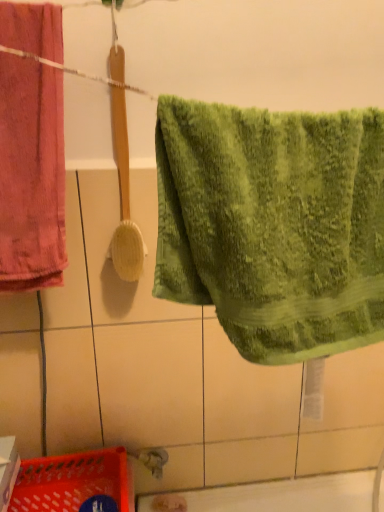
Question: From the image's perspective, would you say wooden textured brush at center is shown under green textured towel at center, placed as the 1th towel when sorted from right to left?

Choices:
 (A) no
 (B) yes

Answer: (A)

Question: From the image's perspective, is wooden textured brush at center on top of green textured towel at center, which ranks as the second towel in left-to-right order?

Choices:
 (A) yes
 (B) no

Answer: (A)

Question: From a real-world perspective, is wooden textured brush at center positioned over green textured towel at center, placed as the 1th towel when sorted from right to left, based on gravity?

Choices:
 (A) no
 (B) yes

Answer: (B)

Question: Is the position of wooden textured brush at center less distant than that of green textured towel at center, which is counted as the 2th towel, starting from the back?

Choices:
 (A) no
 (B) yes

Answer: (A)

Question: Is the position of wooden textured brush at center more distant than that of green textured towel at center, which appears as the first towel when viewed from the front?

Choices:
 (A) yes
 (B) no

Answer: (A)

Question: Are wooden textured brush at center and green textured towel at center, which is counted as the 2th towel, starting from the back, making contact?

Choices:
 (A) no
 (B) yes

Answer: (A)

Question: Is wooden textured brush at center inside velvety pink towel at left, which ranks as the 1th towel in back-to-front order?

Choices:
 (A) no
 (B) yes

Answer: (A)

Question: Does velvety pink towel at left, which ranks as the second towel in front-to-back order, touch wooden textured brush at center?

Choices:
 (A) no
 (B) yes

Answer: (A)

Question: From the image's perspective, is velvety pink towel at left, acting as the 1th towel starting from the left, located above wooden textured brush at center?

Choices:
 (A) no
 (B) yes

Answer: (A)

Question: Is velvety pink towel at left, acting as the 1th towel starting from the left, positioned with its back to wooden textured brush at center?

Choices:
 (A) yes
 (B) no

Answer: (B)

Question: Can you confirm if velvety pink towel at left, which ranks as the 1th towel in back-to-front order, is bigger than wooden textured brush at center?

Choices:
 (A) no
 (B) yes

Answer: (B)

Question: Is velvety pink towel at left, acting as the 1th towel starting from the left, outside wooden textured brush at center?

Choices:
 (A) no
 (B) yes

Answer: (B)

Question: From the image's perspective, does wooden textured brush at center appear lower than velvety pink towel at left, which ranks as the 1th towel in back-to-front order?

Choices:
 (A) yes
 (B) no

Answer: (B)